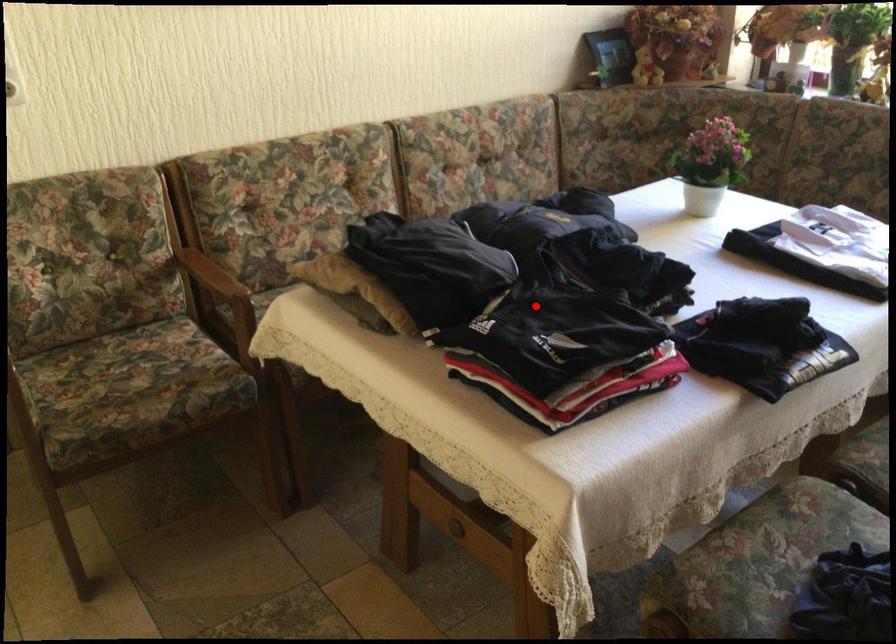
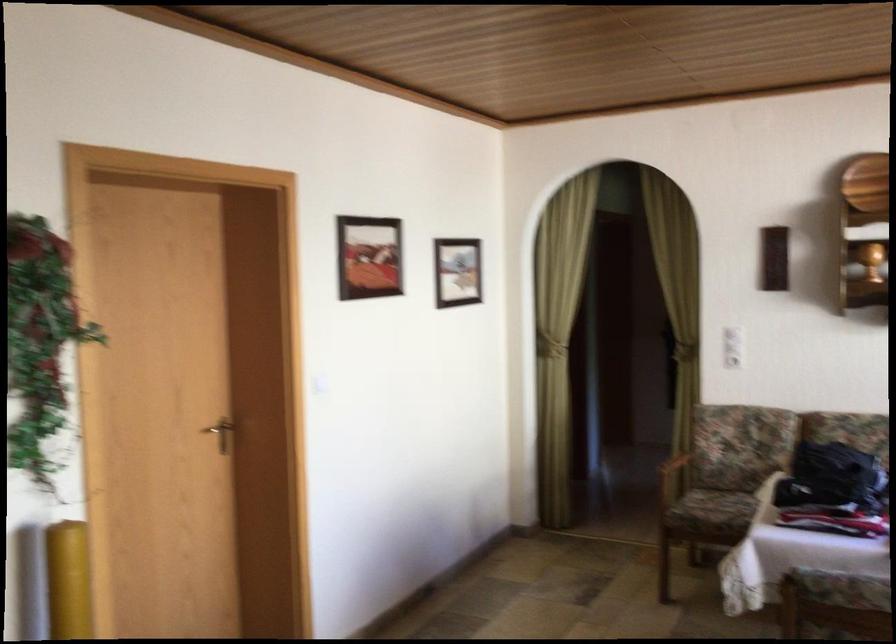
Find the pixel in the second image that matches the highlighted location in the first image.

(831, 478)